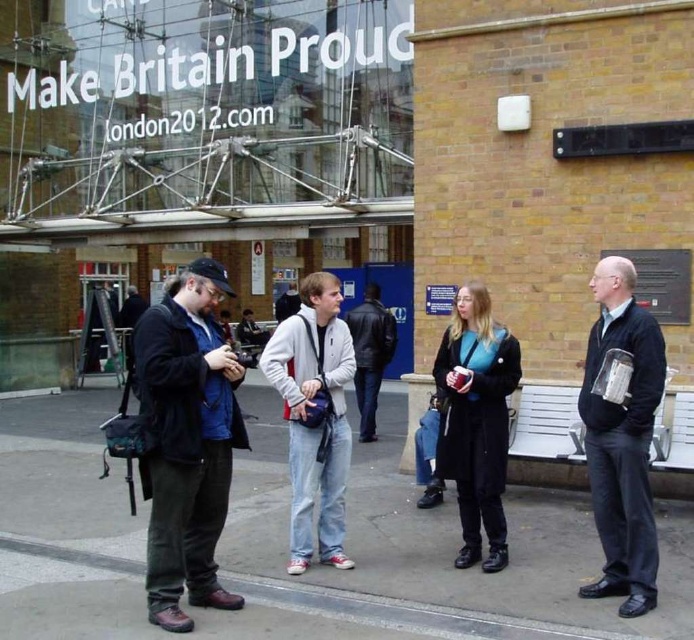
Question: Does matte black jacket at center come behind leather jacket at center?

Choices:
 (A) no
 (B) yes

Answer: (A)

Question: Is dark gray fabric jacket at right to the right of white matte jacket at center from the viewer's perspective?

Choices:
 (A) yes
 (B) no

Answer: (A)

Question: Considering the real-world distances, which object is closest to the leather jacket at center?

Choices:
 (A) dark gray fabric jacket at right
 (B) white matte jacket at center

Answer: (B)

Question: Observing the image, what is the correct spatial positioning of matte black jacket at center in reference to dark gray fabric jacket at right?

Choices:
 (A) right
 (B) left

Answer: (B)

Question: Which of the following is the farthest from the observer?

Choices:
 (A) (176, 276)
 (B) (634, 486)
 (C) (371, 368)
 (D) (339, 547)

Answer: (A)

Question: Which object appears closest to the camera in this image?

Choices:
 (A) dark gray fabric jacket at right
 (B) white matte jacket at center

Answer: (A)